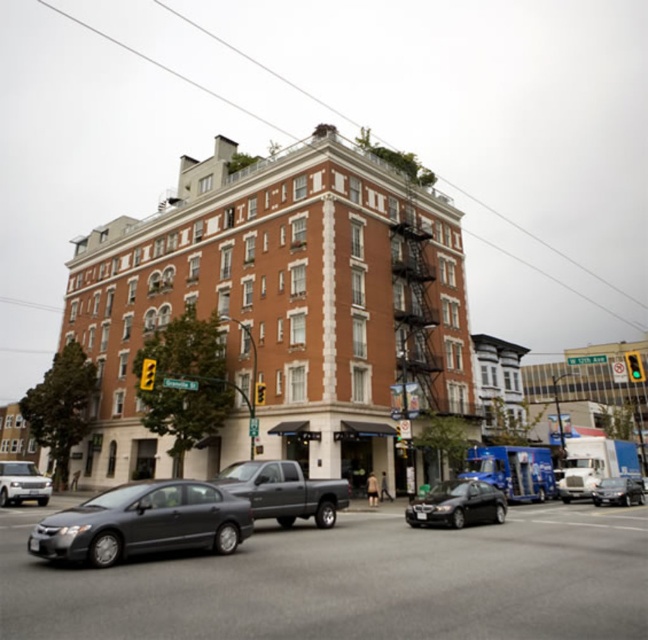
Consider the image. Does gray matte truck at center have a lesser height compared to shiny silver sedan at center?

In fact, gray matte truck at center may be taller than shiny silver sedan at center.

Is point (283, 477) behind point (623, 486)?

No, it is not.

Is point (321, 506) closer to viewer compared to point (625, 493)?

Yes, it is in front of point (625, 493).

You are a GUI agent. You are given a task and a screenshot of the screen. Output one action in this format:
    pyautogui.click(x=<x>, y=<y>)
    Task: Click on the gray matte truck at center
    The image size is (648, 640).
    Given the screenshot: What is the action you would take?
    pyautogui.click(x=284, y=492)

Who is positioned more to the right, metallic gray car at center or matte gray sedan at lower left?

metallic gray car at center is more to the right.

Does metallic gray car at center have a lesser width compared to matte gray sedan at lower left?

In fact, metallic gray car at center might be wider than matte gray sedan at lower left.

Between point (319, 560) and point (216, 540), which one is positioned behind?

The point (216, 540) is more distant.

This screenshot has width=648, height=640. Identify the location of metallic gray car at center. (351, 582).

Between shiny black sedan at center and silver metallic sedan at lower left, which one has less height?

silver metallic sedan at lower left

Does shiny black sedan at center have a greater height compared to silver metallic sedan at lower left?

Correct, shiny black sedan at center is much taller as silver metallic sedan at lower left.

Is point (467, 499) behind point (14, 480)?

That is False.

Locate an element on the screen. The height and width of the screenshot is (640, 648). shiny black sedan at center is located at coordinates (457, 504).